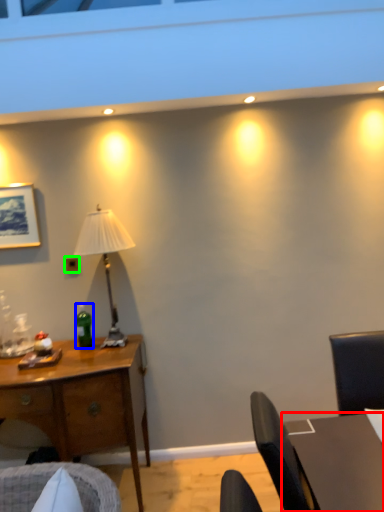
Question: Which object is positioned closest to table (highlighted by a red box)? Select from bottle (highlighted by a blue box) and power outlet (highlighted by a green box).

Choices:
 (A) bottle
 (B) power outlet

Answer: (A)